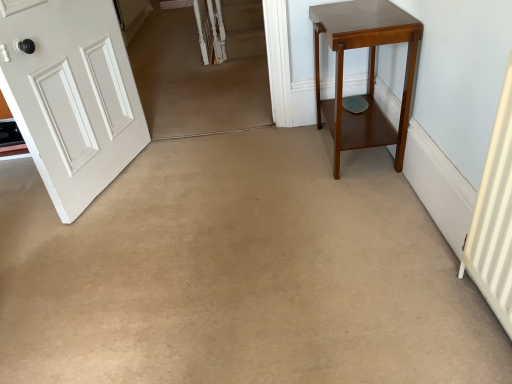
Question: From a real-world perspective, is white painted wood door at left physically located above or below mahogany wood side table at right?

Choices:
 (A) above
 (B) below

Answer: (A)

Question: Choose the correct answer: Is white painted wood door at left inside mahogany wood side table at right or outside it?

Choices:
 (A) outside
 (B) inside

Answer: (A)

Question: Considering their positions, is white painted wood door at left located in front of or behind mahogany wood side table at right?

Choices:
 (A) behind
 (B) front

Answer: (B)

Question: Based on their positions, is mahogany wood side table at right located to the left or right of white painted wood door at left?

Choices:
 (A) right
 (B) left

Answer: (A)

Question: Is mahogany wood side table at right bigger or smaller than white painted wood door at left?

Choices:
 (A) big
 (B) small

Answer: (A)

Question: Is mahogany wood side table at right wider or thinner than white painted wood door at left?

Choices:
 (A) thin
 (B) wide

Answer: (B)

Question: Is point (362, 140) closer or farther from the camera than point (103, 100)?

Choices:
 (A) farther
 (B) closer

Answer: (A)